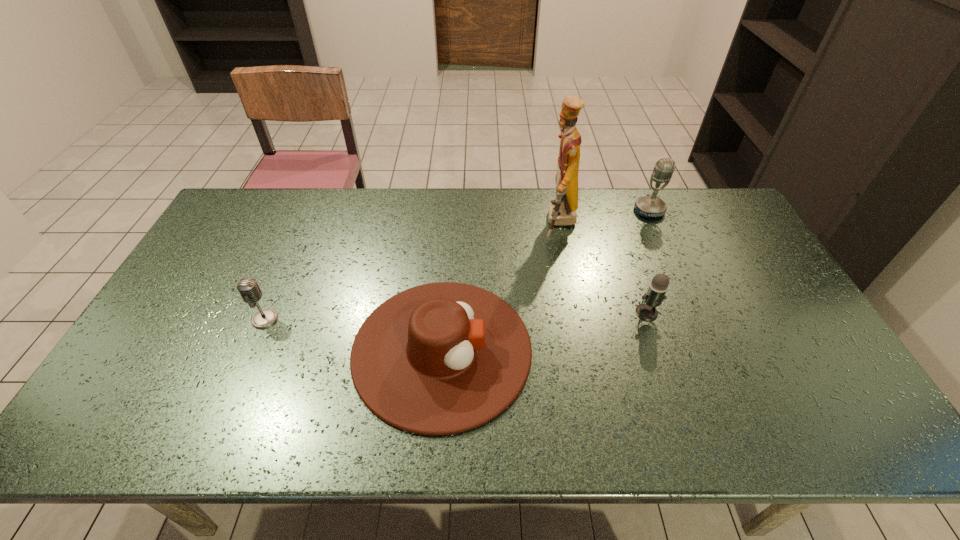
Locate an element on the screen. This screenshot has width=960, height=540. free spot located 0.340m on the front-facing side of the nutcracker is located at coordinates (444, 223).

This screenshot has width=960, height=540. I want to click on vacant space located 0.100m on the front-facing side of the rightmost microphone, so click(x=661, y=239).

At what (x,y) coordinates should I click in order to perform the action: click on vacant space located 0.240m on the right of the second microphone from left to right. Please return your answer as a coordinate pair (x, y). The height and width of the screenshot is (540, 960). Looking at the image, I should click on (744, 312).

Locate an element on the screen. The width and height of the screenshot is (960, 540). free space located 0.250m on the front of the leftmost microphone is located at coordinates (224, 416).

The height and width of the screenshot is (540, 960). Find the location of `free space located on the front-facing side of the shortest object`. free space located on the front-facing side of the shortest object is located at coordinates (643, 350).

Find the location of a particular element. nutcracker that is at the far edge is located at coordinates click(x=562, y=212).

Locate an element on the screen. This screenshot has height=540, width=960. microphone that is at the far edge is located at coordinates (647, 206).

Identify the location of object that is at the near edge. (441, 358).

In the image, there is a desktop. Where is `blank space at the far edge`? The width and height of the screenshot is (960, 540). blank space at the far edge is located at coordinates (389, 221).

You are a GUI agent. You are given a task and a screenshot of the screen. Output one action in this format:
    pyautogui.click(x=<x>, y=<y>)
    Task: Click on the vacant area at the near edge of the desktop
    This screenshot has height=540, width=960.
    Given the screenshot: What is the action you would take?
    pyautogui.click(x=571, y=408)